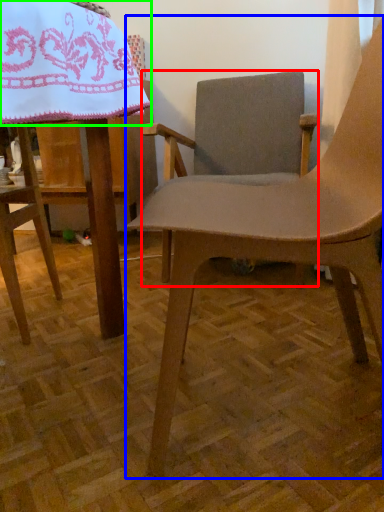
Question: Which object is positioned closest to chair (highlighted by a red box)? Select from chair (highlighted by a blue box) and blanket (highlighted by a green box).

Choices:
 (A) chair
 (B) blanket

Answer: (A)